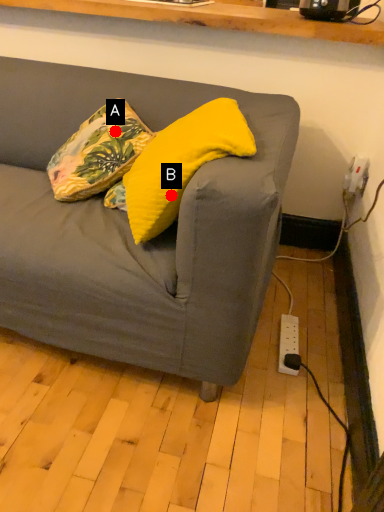
Question: Two points are circled on the image, labeled by A and B beside each circle. Which point is farther to the camera?

Choices:
 (A) A is further
 (B) B is further

Answer: (A)